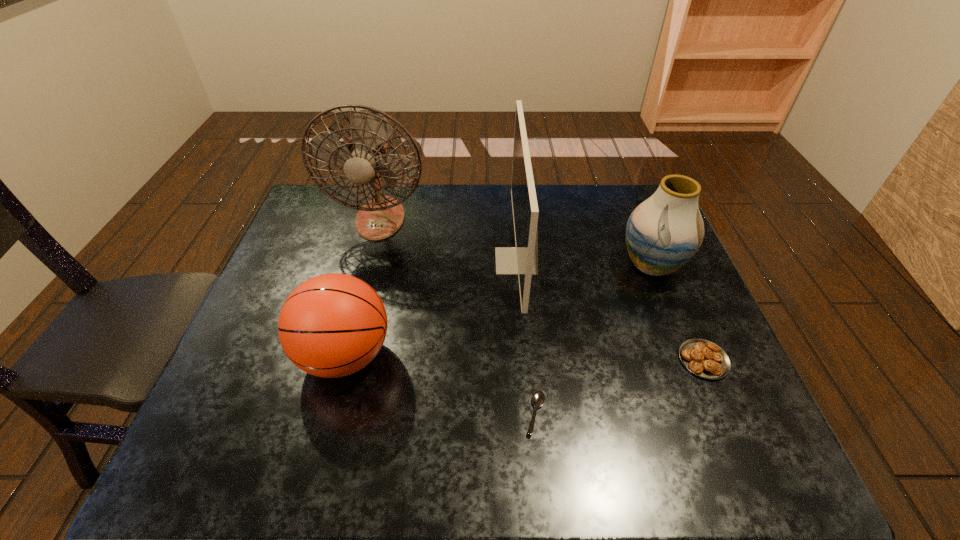
Identify the location of fan. The height and width of the screenshot is (540, 960). (365, 159).

Where is `monitor`? monitor is located at coordinates (522, 260).

Identify the location of vase. (663, 233).

Where is `the third shortest object`? Image resolution: width=960 pixels, height=540 pixels. the third shortest object is located at coordinates (332, 325).

What are the coordinates of `the second shortest object` in the screenshot? It's located at (705, 359).

Where is `the shortest object`? the shortest object is located at coordinates (x=538, y=398).

Where is `vacant region located in front of the fan to direct airflow`? vacant region located in front of the fan to direct airflow is located at coordinates (348, 339).

The height and width of the screenshot is (540, 960). What are the coordinates of `vacant space located 0.130m on the front-facing side of the monitor` in the screenshot? It's located at (451, 261).

The width and height of the screenshot is (960, 540). I want to click on free space located on the front-facing side of the monitor, so click(x=396, y=261).

Where is `vacant space located on the front-facing side of the monitor`? The image size is (960, 540). vacant space located on the front-facing side of the monitor is located at coordinates (478, 261).